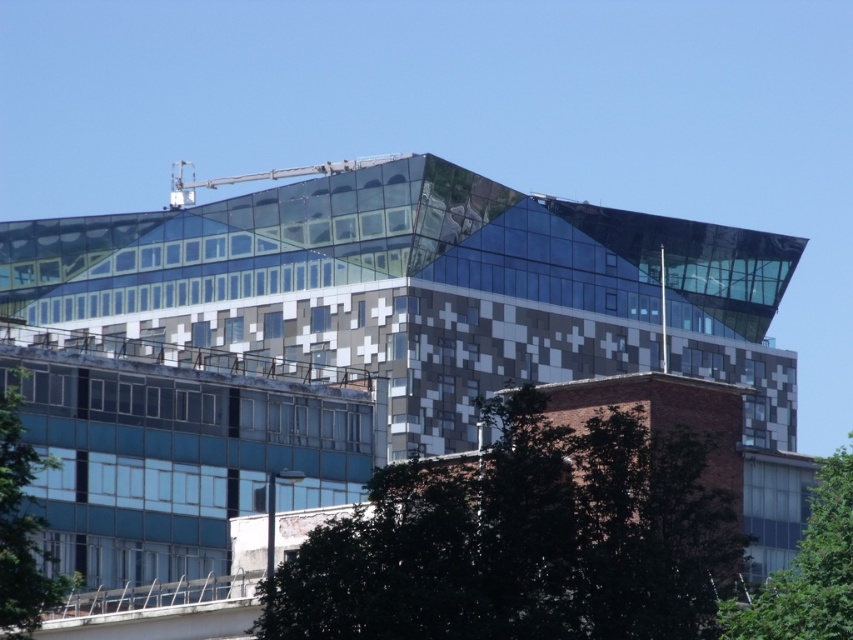
Does green leafy tree at center have a larger size compared to green leafy tree at lower right?

No.

Which is above, green leafy tree at center or green leafy tree at lower right?

green leafy tree at center is above.

Is point (426, 577) in front of point (776, 593)?

No.

In order to click on green leafy tree at center in this screenshot , I will do `click(523, 540)`.

Looking at this image, can you confirm if green leafy tree at center is positioned above green leafy tree at lower left?

Indeed, green leafy tree at center is positioned over green leafy tree at lower left.

Does point (392, 525) lie in front of point (38, 602)?

That is True.

This screenshot has width=853, height=640. Describe the element at coordinates (523, 540) in the screenshot. I see `green leafy tree at center` at that location.

Image resolution: width=853 pixels, height=640 pixels. I want to click on green leafy tree at center, so click(523, 540).

Can you confirm if green leafy tree at lower right is positioned below green leafy tree at lower left?

Correct, green leafy tree at lower right is located below green leafy tree at lower left.

This screenshot has width=853, height=640. What do you see at coordinates (807, 570) in the screenshot?
I see `green leafy tree at lower right` at bounding box center [807, 570].

You are a GUI agent. You are given a task and a screenshot of the screen. Output one action in this format:
    pyautogui.click(x=<x>, y=<y>)
    Task: Click on the green leafy tree at lower right
    
    Given the screenshot: What is the action you would take?
    pyautogui.click(x=807, y=570)